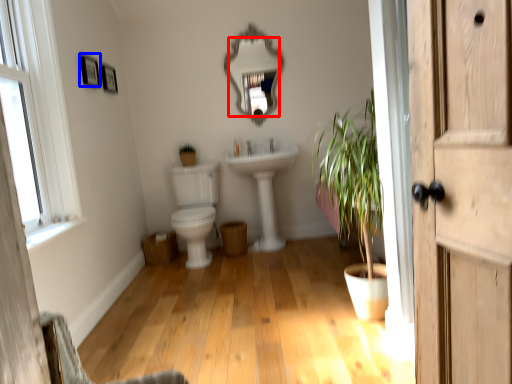
Question: Which object is closer to the camera taking this photo, mirror (highlighted by a red box) or picture frame (highlighted by a blue box)?

Choices:
 (A) mirror
 (B) picture frame

Answer: (B)